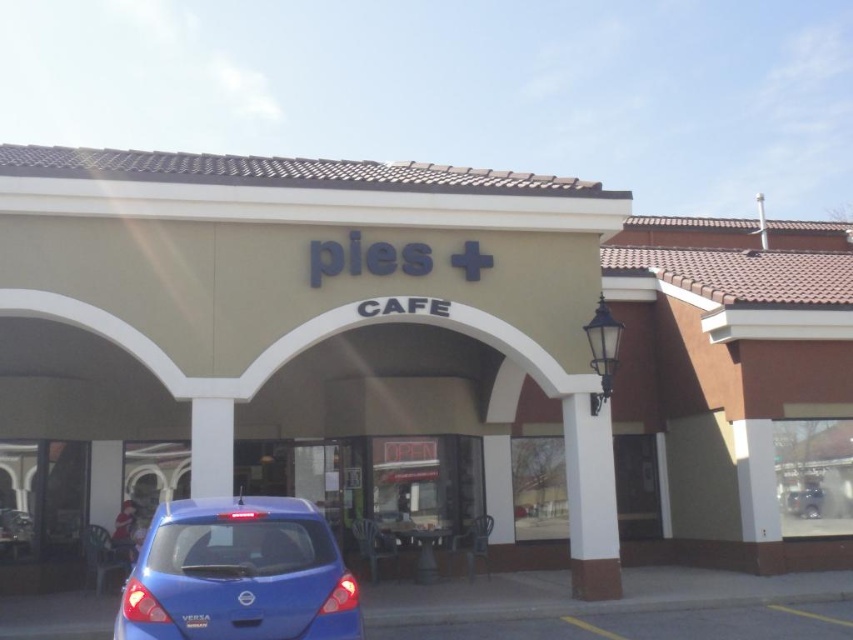
Question: In this image, where is beige stucco cafe at center located relative to blue glossy hatchback at lower left?

Choices:
 (A) below
 (B) above

Answer: (B)

Question: Does beige stucco cafe at center come behind blue glossy hatchback at lower left?

Choices:
 (A) no
 (B) yes

Answer: (B)

Question: Does beige stucco cafe at center appear on the right side of blue glossy hatchback at lower left?

Choices:
 (A) no
 (B) yes

Answer: (B)

Question: Which of the following is the closest to the observer?

Choices:
 (A) (518, 456)
 (B) (271, 513)

Answer: (B)